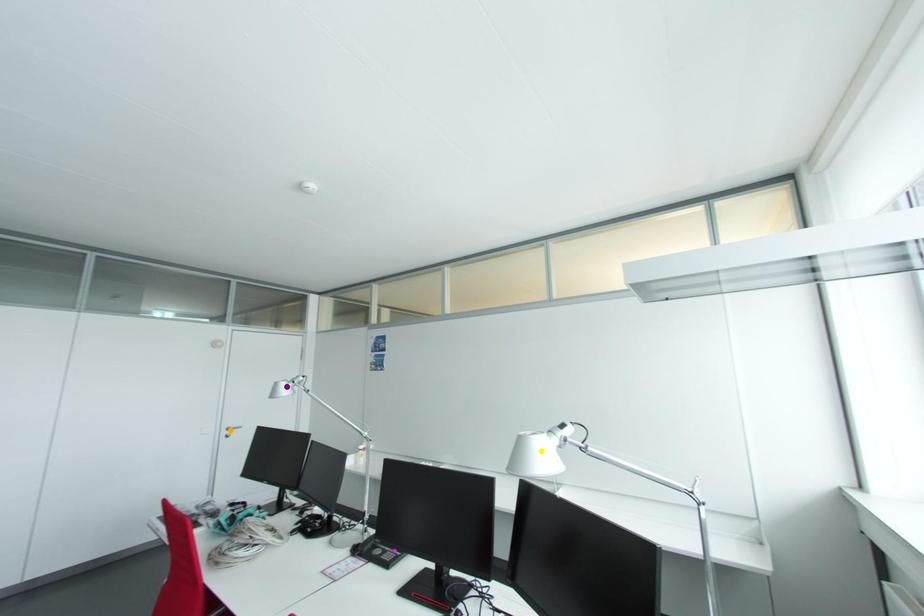
Order these from nearest to farthest:
orange point | purple point | yellow point

yellow point
purple point
orange point